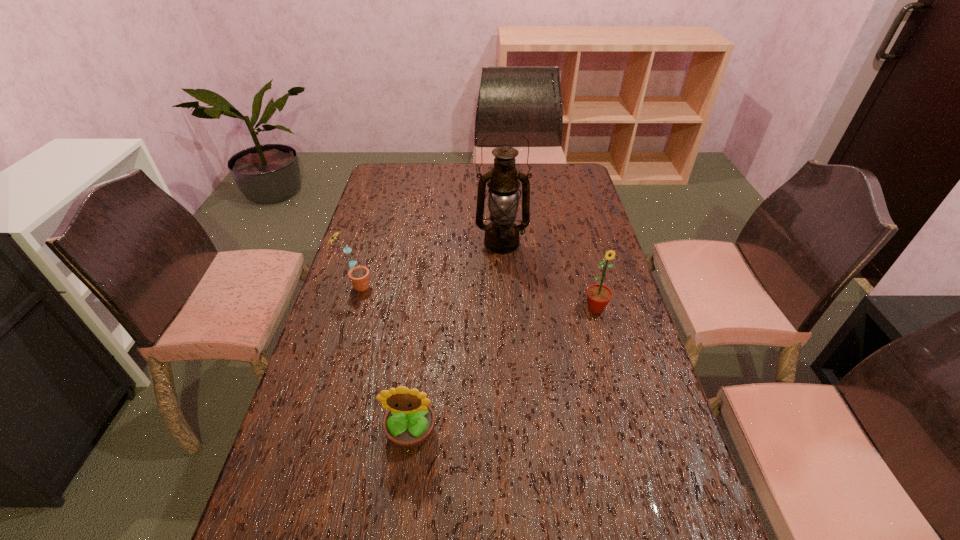
This screenshot has height=540, width=960. Find the location of `the tallest object`. the tallest object is located at coordinates (501, 236).

The width and height of the screenshot is (960, 540). I want to click on oil lamp, so click(x=501, y=236).

This screenshot has width=960, height=540. Find the location of `the rightmost sunflower`. the rightmost sunflower is located at coordinates (598, 296).

Identify the location of the third farthest object. This screenshot has height=540, width=960. (x=598, y=296).

Identify the location of the leftmost sunflower. (359, 275).

Where is `the farthest sunflower`? the farthest sunflower is located at coordinates (359, 275).

Find the location of a particular element. the second sunflower from right to left is located at coordinates (409, 421).

Where is `the shortest object`? The height and width of the screenshot is (540, 960). the shortest object is located at coordinates (409, 421).

In order to click on vacant space located 0.340m on the front of the oil lamp in this screenshot , I will do `click(507, 329)`.

At what (x,y) coordinates should I click in order to perform the action: click on free location located on the face of the third farthest object. Please return your answer as a coordinate pair (x, y). The width and height of the screenshot is (960, 540). Looking at the image, I should click on (616, 383).